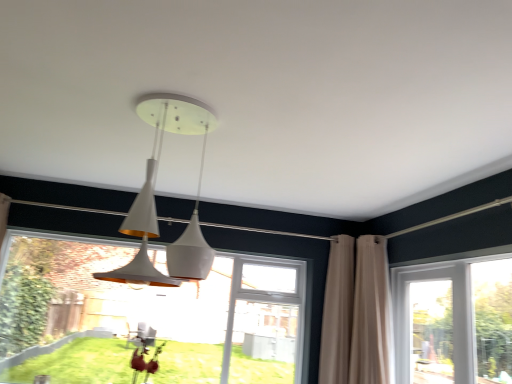
Question: Should I look upward or downward to see beige fabric curtain at right, which ranks as the 1th curtain in right-to-left order?

Choices:
 (A) up
 (B) down

Answer: (B)

Question: Is beige fabric curtain at right, which ranks as the 1th curtain in right-to-left order, next to transparent glass window at lower left, positioned as the first window in left-to-right order?

Choices:
 (A) yes
 (B) no

Answer: (B)

Question: Considering the relative sizes of beige fabric curtain at right, which ranks as the second curtain in left-to-right order, and transparent glass window at lower left, positioned as the first window in left-to-right order, in the image provided, is beige fabric curtain at right, which ranks as the second curtain in left-to-right order, taller than transparent glass window at lower left, positioned as the first window in left-to-right order,?

Choices:
 (A) yes
 (B) no

Answer: (B)

Question: From a real-world perspective, is beige fabric curtain at right, which ranks as the 1th curtain in right-to-left order, below transparent glass window at lower left, the 2th window when ordered from right to left?

Choices:
 (A) no
 (B) yes

Answer: (A)

Question: Is beige fabric curtain at right, which ranks as the 1th curtain in right-to-left order, located outside transparent glass window at lower left, positioned as the first window in left-to-right order?

Choices:
 (A) yes
 (B) no

Answer: (A)

Question: Is beige fabric curtain at right, which ranks as the second curtain in left-to-right order, oriented away from transparent glass window at lower left, positioned as the first window in left-to-right order?

Choices:
 (A) yes
 (B) no

Answer: (B)

Question: Is there a large distance between beige fabric curtain at right, which ranks as the 1th curtain in right-to-left order, and transparent glass window at lower left, positioned as the first window in left-to-right order?

Choices:
 (A) yes
 (B) no

Answer: (A)

Question: Does clear glass door at right, positioned as the first window in right-to-left order, have a greater width compared to beige fabric curtain at right, which ranks as the second curtain in left-to-right order?

Choices:
 (A) yes
 (B) no

Answer: (B)

Question: Does clear glass door at right, positioned as the first window in right-to-left order, appear on the right side of beige fabric curtain at right, which ranks as the 1th curtain in right-to-left order?

Choices:
 (A) no
 (B) yes

Answer: (B)

Question: From a real-world perspective, is clear glass door at right, acting as the 2th window starting from the left, located higher than beige fabric curtain at right, which ranks as the 1th curtain in right-to-left order?

Choices:
 (A) no
 (B) yes

Answer: (A)

Question: Would you say clear glass door at right, positioned as the first window in right-to-left order, is a long distance from beige fabric curtain at right, which ranks as the 1th curtain in right-to-left order?

Choices:
 (A) yes
 (B) no

Answer: (B)

Question: Is clear glass door at right, positioned as the first window in right-to-left order, thinner than beige fabric curtain at right, which ranks as the second curtain in left-to-right order?

Choices:
 (A) no
 (B) yes

Answer: (B)

Question: Is clear glass door at right, acting as the 2th window starting from the left, bigger than beige fabric curtain at right, which ranks as the 1th curtain in right-to-left order?

Choices:
 (A) no
 (B) yes

Answer: (A)

Question: Is white glossy pendant light at center not inside transparent glass window at lower left, positioned as the first window in left-to-right order?

Choices:
 (A) no
 (B) yes

Answer: (B)